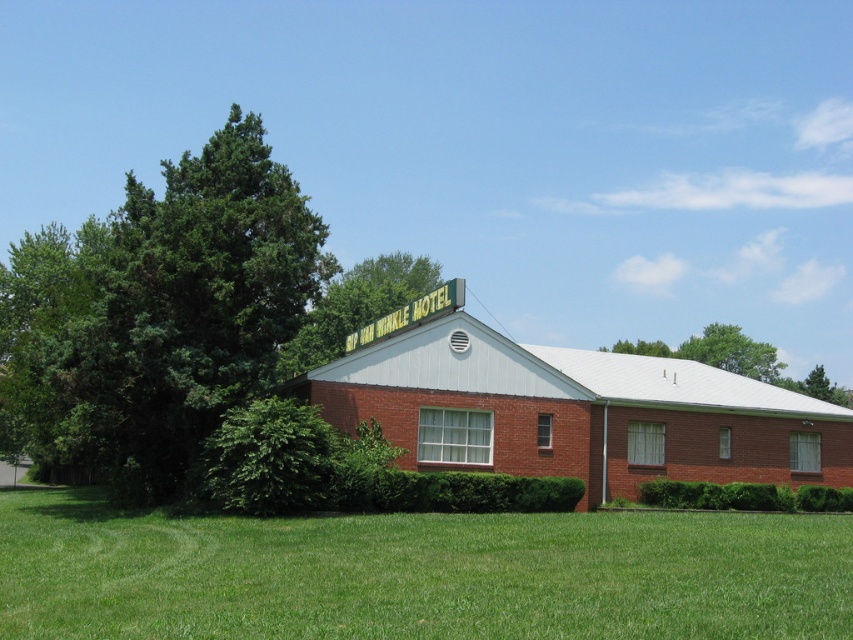
Is green leafy tree at upper center shorter than green leafy tree at upper right?

No.

Can you confirm if green leafy tree at upper center is taller than green leafy tree at upper right?

Yes.

You are a GUI agent. You are given a task and a screenshot of the screen. Output one action in this format:
    pyautogui.click(x=<x>, y=<y>)
    Task: Click on the green leafy tree at upper center
    The width and height of the screenshot is (853, 640).
    Given the screenshot: What is the action you would take?
    pyautogui.click(x=355, y=307)

Who is more distant from viewer, [175,595] or [321,301]?

The point [321,301] is behind.

Is green grass at lower center shorter than green leafy tree at upper center?

Yes, green grass at lower center is shorter than green leafy tree at upper center.

This screenshot has height=640, width=853. Describe the element at coordinates (416, 573) in the screenshot. I see `green grass at lower center` at that location.

At what (x,y) coordinates should I click in order to perform the action: click on green grass at lower center. Please return your answer as a coordinate pair (x, y). Looking at the image, I should click on (416, 573).

Who is lower down, green grass at lower center or green leafy bush at lower left?

green grass at lower center is below.

Who is more forward, (30, 509) or (228, 497)?

Point (228, 497) is in front.

Where is `green grass at lower center`? This screenshot has height=640, width=853. green grass at lower center is located at coordinates (416, 573).